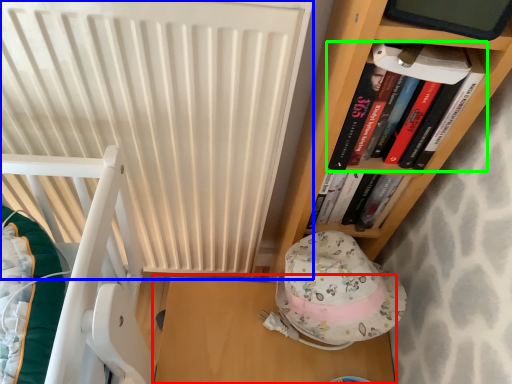
Question: Which object is the closest to the table (highlighted by a red box)? Choose among these: radiator (highlighted by a blue box) or book (highlighted by a green box).

Choices:
 (A) radiator
 (B) book

Answer: (A)